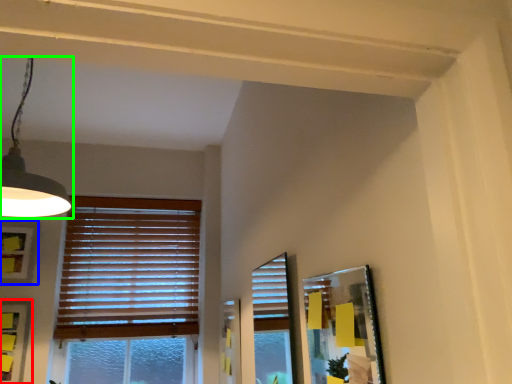
Question: Estimate the real-world distances between objects in this image. Which object is closer to picture frame (highlighted by a red box), picture frame (highlighted by a blue box) or lamp (highlighted by a green box)?

Choices:
 (A) picture frame
 (B) lamp

Answer: (A)